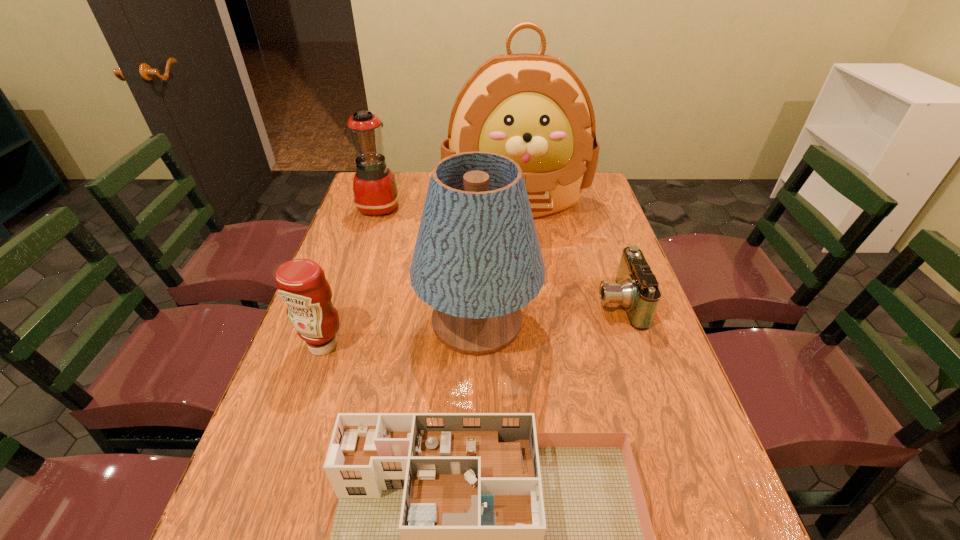
The image size is (960, 540). Identify the location of vacant space situated 0.340m on the front-facing side of the camcorder. (471, 302).

Find the location of `vacant area situated 0.200m on the front-facing side of the camcorder`. vacant area situated 0.200m on the front-facing side of the camcorder is located at coordinates (522, 302).

Find the location of `backpack present at the far edge`. backpack present at the far edge is located at coordinates (533, 108).

In order to click on food processor present at the far edge in this screenshot , I will do `click(375, 191)`.

I want to click on food processor at the left edge, so click(375, 191).

The image size is (960, 540). I want to click on condiment positioned at the left edge, so click(301, 283).

Image resolution: width=960 pixels, height=540 pixels. What are the coordinates of `backpack located at the right edge` in the screenshot? It's located at (533, 108).

Where is `camcorder that is at the right edge`? The height and width of the screenshot is (540, 960). camcorder that is at the right edge is located at coordinates (636, 289).

Where is `object at the far left corner`? This screenshot has height=540, width=960. object at the far left corner is located at coordinates (375, 191).

Identify the location of object that is at the far right corner. (533, 108).